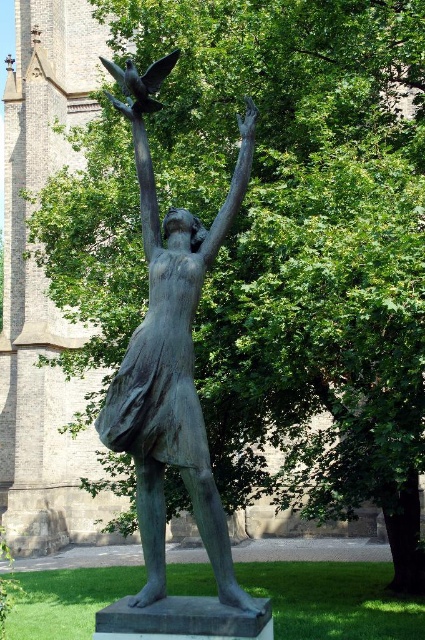
You are a photographer aiming to capture the bronze statue at center and the shiny black bird at upper center in a single frame. Based on their positions, will the statue block the view of the bird in your photo?

The bronze statue at center is in front of the shiny black bird at upper center, so the statue will block the view of the bird in the photo.

You are a park visitor standing in front of the bronze statue at center. You notice the shiny black bird at upper center perched somewhere. Based on the statue and bird positions, where would the bird be relative to the statue?

The shiny black bird at upper center is perched above the bronze statue at center, as the statue is located below the bird.